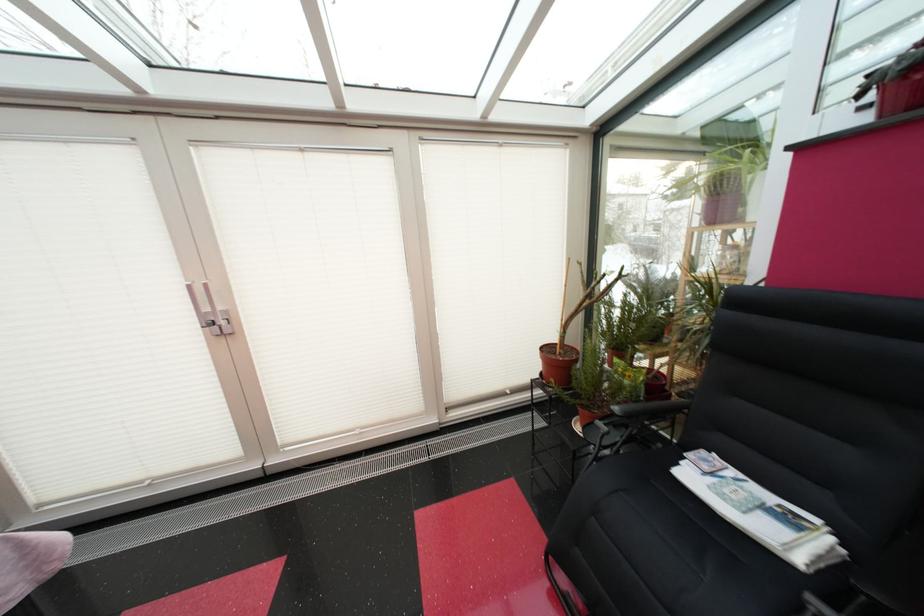
I want to click on stack of magazines, so click(760, 512).